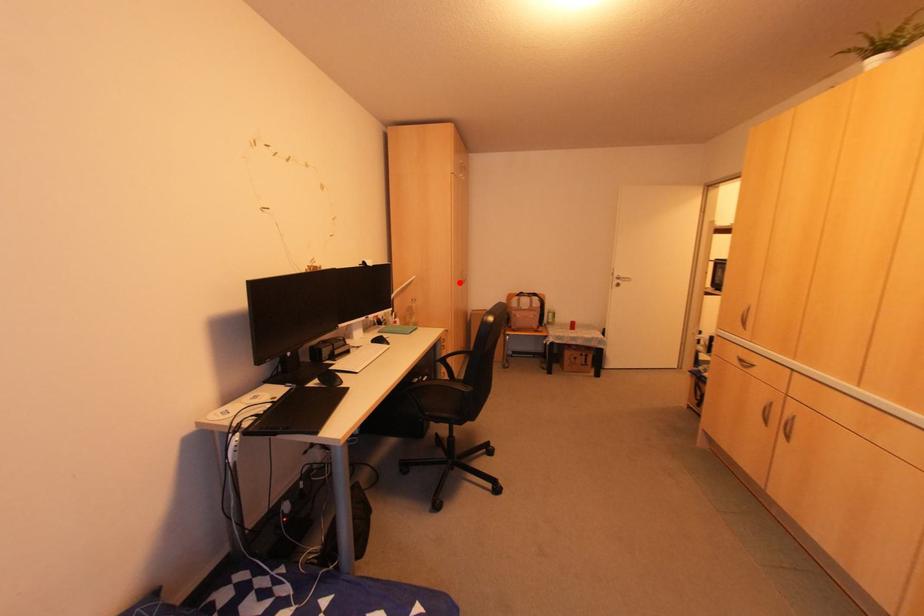
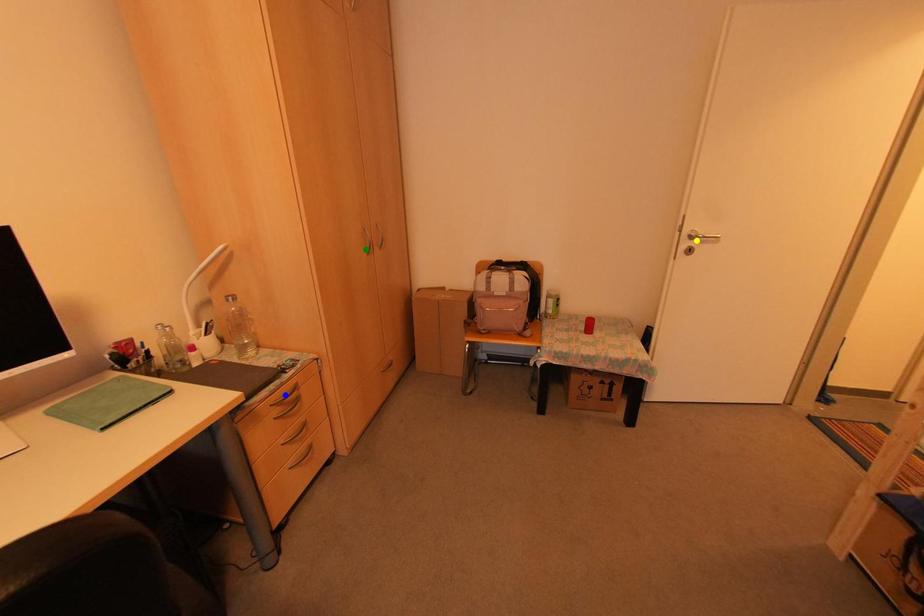
Question: I am providing you with two images of the same scene from different viewpoints. A red point is marked on the first image. You are given multiple points on the second image. Which spot in image 2 lines up with the point in image 1?

Choices:
 (A) green point
 (B) yellow point
 (C) blue point

Answer: (A)